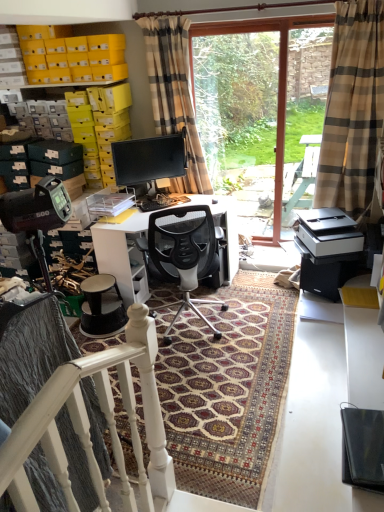
Question: From a real-world perspective, is transparent glass door at center positioned over matte black monitor at center based on gravity?

Choices:
 (A) no
 (B) yes

Answer: (B)

Question: Is transparent glass door at center not close to matte black monitor at center?

Choices:
 (A) yes
 (B) no

Answer: (B)

Question: Considering the relative sizes of transparent glass door at center and matte black monitor at center in the image provided, is transparent glass door at center bigger than matte black monitor at center?

Choices:
 (A) yes
 (B) no

Answer: (A)

Question: Does transparent glass door at center have a lesser width compared to matte black monitor at center?

Choices:
 (A) yes
 (B) no

Answer: (B)

Question: From the image's perspective, is transparent glass door at center under matte black monitor at center?

Choices:
 (A) yes
 (B) no

Answer: (B)

Question: Does point 158,124 appear closer or farther from the camera than point 117,180?

Choices:
 (A) closer
 (B) farther

Answer: (B)

Question: From the image's perspective, is plaid fabric curtain at center, the first curtain viewed from the left, located above or below matte black monitor at center?

Choices:
 (A) above
 (B) below

Answer: (A)

Question: Which is correct: plaid fabric curtain at center, the first curtain viewed from the left, is inside matte black monitor at center, or outside of it?

Choices:
 (A) inside
 (B) outside

Answer: (B)

Question: Looking at their shapes, would you say plaid fabric curtain at center, the second curtain from the right, is wider or thinner than matte black monitor at center?

Choices:
 (A) wide
 (B) thin

Answer: (A)

Question: Looking at their shapes, would you say white glossy desk at center is wider or thinner than black textured stool at lower left?

Choices:
 (A) thin
 (B) wide

Answer: (B)

Question: From the image's perspective, is white glossy desk at center located above or below black textured stool at lower left?

Choices:
 (A) below
 (B) above

Answer: (B)

Question: Is white glossy desk at center situated inside black textured stool at lower left or outside?

Choices:
 (A) inside
 (B) outside

Answer: (B)

Question: From their relative heights in the image, would you say white glossy desk at center is taller or shorter than black textured stool at lower left?

Choices:
 (A) tall
 (B) short

Answer: (A)

Question: Looking at the image, does plaid fabric curtain at center, the first curtain viewed from the left, seem bigger or smaller compared to black plastic printer at lower right?

Choices:
 (A) big
 (B) small

Answer: (A)

Question: From a real-world perspective, is plaid fabric curtain at center, the first curtain viewed from the left, physically located above or below black plastic printer at lower right?

Choices:
 (A) below
 (B) above

Answer: (B)